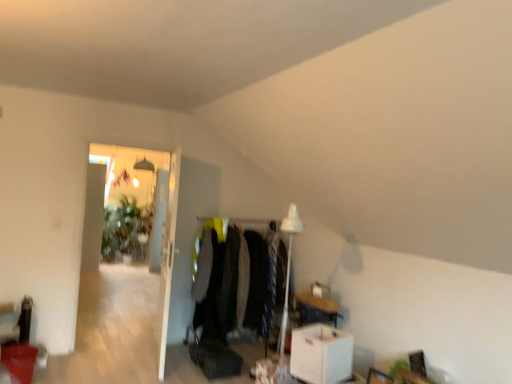
Question: From a real-world perspective, is white cardboard box at lower right positioned above or below velvet black coat at center?

Choices:
 (A) above
 (B) below

Answer: (B)

Question: Does point (301, 372) appear closer or farther from the camera than point (229, 322)?

Choices:
 (A) farther
 (B) closer

Answer: (B)

Question: Estimate the real-world distances between objects in this image. Which object is farther from the velvet black coat at center?

Choices:
 (A) white cardboard box at lower right
 (B) transparent glass door at left
 (C) white glossy door at upper left

Answer: (B)

Question: Considering the real-world distances, which object is closest to the transparent glass door at left?

Choices:
 (A) white glossy door at upper left
 (B) velvet black coat at center
 (C) white cardboard box at lower right

Answer: (A)